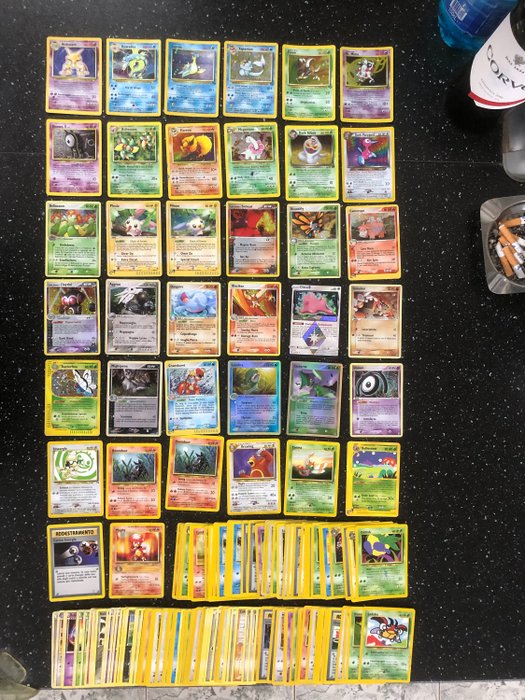
Locate an element on the screen. cigarette butts in an ashtray is located at coordinates (512, 220), (520, 239), (512, 238), (503, 239), (512, 257), (507, 267).